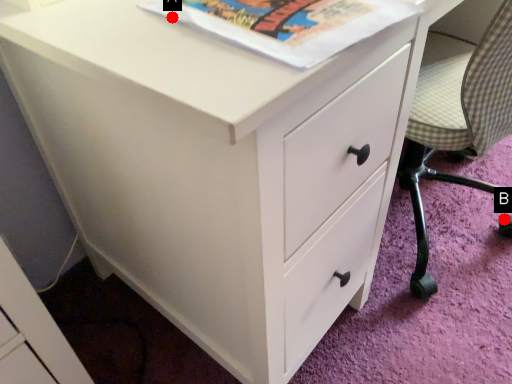
Question: Two points are circled on the image, labeled by A and B beside each circle. Which point is closer to the camera?

Choices:
 (A) A is closer
 (B) B is closer

Answer: (A)